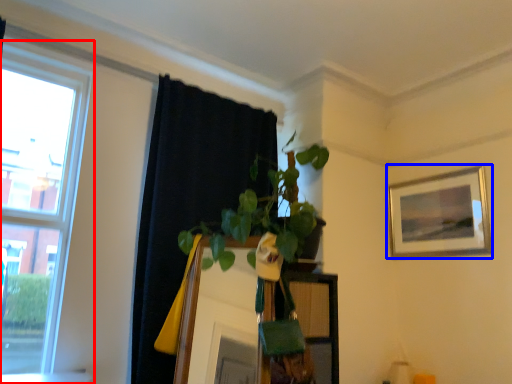
Question: Which of the following is the closest to the observer, window (highlighted by a red box) or picture frame (highlighted by a blue box)?

Choices:
 (A) window
 (B) picture frame

Answer: (A)